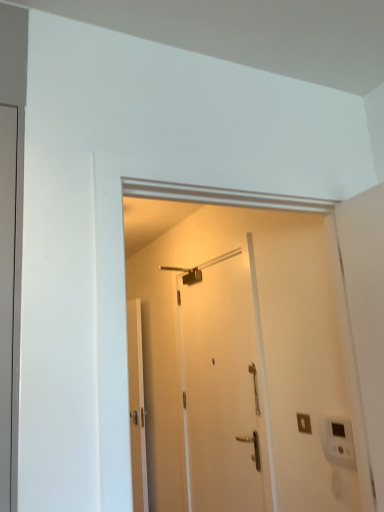
Describe the element at coordinates (137, 407) in the screenshot. I see `white glossy door at center, arranged as the 3th door when viewed from the front` at that location.

This screenshot has height=512, width=384. What do you see at coordinates (7, 292) in the screenshot? I see `matte gray door at left, the third door when ordered from back to front` at bounding box center [7, 292].

Find the location of a particular element. This screenshot has height=512, width=384. white matte door at center, the third door viewed from the left is located at coordinates (223, 389).

Locate an element on the screen. Image resolution: width=384 pixels, height=512 pixels. white glossy door at center, arranged as the 3th door when viewed from the front is located at coordinates (137, 407).

From a real-world perspective, which is physically above, metallic silver shower at upper center or white matte door at center, the third door viewed from the left?

metallic silver shower at upper center is physically above.

How many degrees apart are the facing directions of metallic silver shower at upper center and white matte door at center, which appears as the first door when viewed from the right?

1.31 degrees.

Is metallic silver shower at upper center looking in the opposite direction of white matte door at center, the third door viewed from the left?

Yes.

Can you confirm if metallic silver shower at upper center is thinner than white matte door at center, which appears as the first door when viewed from the right?

In fact, metallic silver shower at upper center might be wider than white matte door at center, which appears as the first door when viewed from the right.

Would you say white matte door at center, which is the 2th door from back to front, is part of matte gray door at left, arranged as the 1th door when viewed from the left,'s contents?

No, white matte door at center, which is the 2th door from back to front, is not surrounded by matte gray door at left, arranged as the 1th door when viewed from the left.

Based on the photo, from a real-world perspective, which object rests below the other?

white matte door at center, the third door viewed from the left.

Is metallic silver shower at upper center oriented towards matte gray door at left, the third door viewed from the right?

No, metallic silver shower at upper center is not turned towards matte gray door at left, the third door viewed from the right.

From a real-world perspective, is metallic silver shower at upper center above or below matte gray door at left, arranged as the 1th door when viewed from the left?

Clearly, from a real-world perspective, metallic silver shower at upper center is above matte gray door at left, arranged as the 1th door when viewed from the left.

Is metallic silver shower at upper center not near matte gray door at left, the third door viewed from the right?

Yes, metallic silver shower at upper center and matte gray door at left, the third door viewed from the right, are quite far apart.

Would you say metallic silver shower at upper center is to the left or to the right of matte gray door at left, the first door viewed from the front, in the picture?

In the image, metallic silver shower at upper center appears on the right side of matte gray door at left, the first door viewed from the front.

Which object is thinner, white matte door at center, which is the 2th door from back to front, or white glossy door at center, arranged as the second door when viewed from the left?

white matte door at center, which is the 2th door from back to front.

Is point (235, 449) in front of point (134, 318)?

Yes, it is in front of point (134, 318).

Is white matte door at center, which appears as the first door when viewed from the right, not near white glossy door at center, arranged as the second door when viewed from the left?

Yes.

Is white matte door at center, the third door viewed from the left, smaller than white glossy door at center, arranged as the second door when viewed from the left?

Incorrect, white matte door at center, the third door viewed from the left, is not smaller in size than white glossy door at center, arranged as the second door when viewed from the left.

You are a GUI agent. You are given a task and a screenshot of the screen. Output one action in this format:
    pyautogui.click(x=<x>, y=<y>)
    Task: Click on the door that is the 1st object located in front of the white glossy door at center, which ranks as the 2th door in right-to-left order
    
    Given the screenshot: What is the action you would take?
    pyautogui.click(x=223, y=389)

Could white matte door at center, which appears as the first door when viewed from the right, be considered to be inside white glossy door at center, the first door positioned from the back?

No.

Who is smaller, white glossy door at center, arranged as the second door when viewed from the left, or white matte door at center, the 2th door in the front-to-back sequence?

white glossy door at center, arranged as the second door when viewed from the left.

Is white glossy door at center, the first door positioned from the back, far from white matte door at center, the third door viewed from the left?

Yes, white glossy door at center, the first door positioned from the back, and white matte door at center, the third door viewed from the left, are quite far apart.

Considering the sizes of objects white matte door at center, the 2th door in the front-to-back sequence, and metallic silver shower at upper center in the image provided, who is smaller, white matte door at center, the 2th door in the front-to-back sequence, or metallic silver shower at upper center?

With smaller size is metallic silver shower at upper center.

Does white matte door at center, the 2th door in the front-to-back sequence, have a lesser height compared to metallic silver shower at upper center?

No, white matte door at center, the 2th door in the front-to-back sequence, is not shorter than metallic silver shower at upper center.

Which is more to the right, white matte door at center, which is the 2th door from back to front, or metallic silver shower at upper center?

white matte door at center, which is the 2th door from back to front, is more to the right.

How different are the orientations of white matte door at center, which appears as the first door when viewed from the right, and metallic silver shower at upper center in degrees?

The angle between the facing direction of white matte door at center, which appears as the first door when viewed from the right, and the facing direction of metallic silver shower at upper center is 1.31 degrees.

How distant is matte gray door at left, the first door viewed from the front, from white glossy door at center, arranged as the second door when viewed from the left?

matte gray door at left, the first door viewed from the front, and white glossy door at center, arranged as the second door when viewed from the left, are 9.37 feet apart.

Who is smaller, matte gray door at left, the third door when ordered from back to front, or white glossy door at center, the first door positioned from the back?

white glossy door at center, the first door positioned from the back.

Which door is the 1st one when counting from the right side of the matte gray door at left, the third door viewed from the right? Please provide its 2D coordinates.

[(137, 407)]

From the metallic silver shower at upper center, count 1st doors forward and point to it. Please provide its 2D coordinates.

[(223, 389)]

Identify the location of the 2nd door to the left of the white matte door at center, the 2th door in the front-to-back sequence, counting from the anchor's position. pos(7,292).

Looking at the image, which one is located further to white matte door at center, the 2th door in the front-to-back sequence, metallic silver shower at upper center or white glossy door at center, the first door positioned from the back?

white glossy door at center, the first door positioned from the back, is further to white matte door at center, the 2th door in the front-to-back sequence.

From the image, which object appears to be farther from white glossy door at center, arranged as the 3th door when viewed from the front, matte gray door at left, the third door viewed from the right, or white matte door at center, which appears as the first door when viewed from the right?

The object further to white glossy door at center, arranged as the 3th door when viewed from the front, is matte gray door at left, the third door viewed from the right.

From the image, which object appears to be nearer to matte gray door at left, the third door when ordered from back to front, metallic silver shower at upper center or white matte door at center, the 2th door in the front-to-back sequence?

Based on the image, white matte door at center, the 2th door in the front-to-back sequence, appears to be nearer to matte gray door at left, the third door when ordered from back to front.

In the scene shown: Estimate the real-world distances between objects in this image. Which object is further from white matte door at center, the third door viewed from the left, matte gray door at left, arranged as the 1th door when viewed from the left, or metallic silver shower at upper center?

matte gray door at left, arranged as the 1th door when viewed from the left, lies further to white matte door at center, the third door viewed from the left, than the other object.

Which object lies further to the anchor point metallic silver shower at upper center, white matte door at center, the 2th door in the front-to-back sequence, or matte gray door at left, the first door viewed from the front?

matte gray door at left, the first door viewed from the front, lies further to metallic silver shower at upper center than the other object.

When comparing their distances from matte gray door at left, arranged as the 1th door when viewed from the left, does white matte door at center, the third door viewed from the left, or white glossy door at center, which ranks as the 2th door in right-to-left order, seem further?

white glossy door at center, which ranks as the 2th door in right-to-left order, is positioned further to the anchor matte gray door at left, arranged as the 1th door when viewed from the left.

Estimate the real-world distances between objects in this image. Which object is closer to white glossy door at center, arranged as the second door when viewed from the left, metallic silver shower at upper center or matte gray door at left, the first door viewed from the front?

Based on the image, metallic silver shower at upper center appears to be nearer to white glossy door at center, arranged as the second door when viewed from the left.

Estimate the real-world distances between objects in this image. Which object is further from metallic silver shower at upper center, white matte door at center, which appears as the first door when viewed from the right, or white glossy door at center, which ranks as the 2th door in right-to-left order?

white glossy door at center, which ranks as the 2th door in right-to-left order, is further to metallic silver shower at upper center.

The width and height of the screenshot is (384, 512). Identify the location of shower between white matte door at center, which is the 2th door from back to front, and white glossy door at center, which ranks as the 2th door in right-to-left order, from front to back. (186, 274).

What are the coordinates of `door between matte gray door at left, the third door viewed from the right, and metallic silver shower at upper center from front to back` in the screenshot? It's located at (223, 389).

This screenshot has height=512, width=384. Identify the location of shower between matte gray door at left, arranged as the 1th door when viewed from the left, and white glossy door at center, which ranks as the 2th door in right-to-left order, from front to back. (186, 274).

The width and height of the screenshot is (384, 512). I want to click on door between matte gray door at left, the third door viewed from the right, and white glossy door at center, arranged as the second door when viewed from the left, in the front-back direction, so click(x=223, y=389).